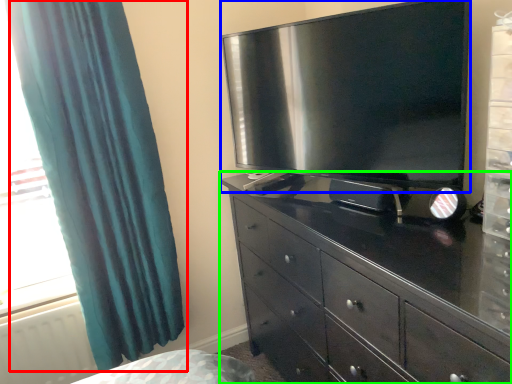
Question: Which object is positioned closest to curtain (highlighted by a red box)? Select from television (highlighted by a blue box) and chest of drawers (highlighted by a green box).

Choices:
 (A) television
 (B) chest of drawers

Answer: (A)